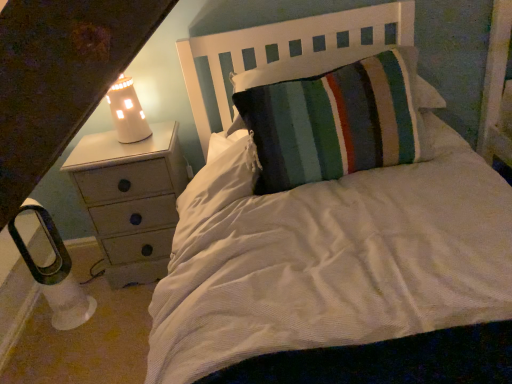
Where is `white ceramic lamp at upper left, the 2th lamp ordered from the bottom`? The height and width of the screenshot is (384, 512). white ceramic lamp at upper left, the 2th lamp ordered from the bottom is located at coordinates (127, 112).

Measure the distance between point [48,297] and camera.

The depth of point [48,297] is 1.80 meters.

Describe the element at coordinates (55, 274) in the screenshot. The image size is (512, 384). I see `white plastic lamp at lower left, the 1th lamp positioned from the bottom` at that location.

What are the coordinates of `white ceramic lamp at upper left, which is the 1th lamp from right to left` in the screenshot? It's located at (127, 112).

Considering their positions, is white wood headboard at upper center located in front of or behind white ceramic lamp at upper left, positioned as the 1th lamp in top-to-bottom order?

white wood headboard at upper center is in front of white ceramic lamp at upper left, positioned as the 1th lamp in top-to-bottom order.

Does white wood headboard at upper center appear on the right side of white ceramic lamp at upper left, the 2th lamp ordered from the bottom?

Yes, white wood headboard at upper center is to the right of white ceramic lamp at upper left, the 2th lamp ordered from the bottom.

In terms of height, does white wood headboard at upper center look taller or shorter compared to white ceramic lamp at upper left, positioned as the 1th lamp in top-to-bottom order?

Clearly, white wood headboard at upper center is shorter compared to white ceramic lamp at upper left, positioned as the 1th lamp in top-to-bottom order.

Does white wood headboard at upper center have a greater width compared to white ceramic lamp at upper left, acting as the 2th lamp starting from the left?

Yes, white wood headboard at upper center is wider than white ceramic lamp at upper left, acting as the 2th lamp starting from the left.

Is white ceramic lamp at upper left, positioned as the 1th lamp in top-to-bottom order, taller than white plastic lamp at lower left, acting as the second lamp starting from the top?

No.

Considering the sizes of objects white ceramic lamp at upper left, the 2th lamp ordered from the bottom, and white plastic lamp at lower left, acting as the second lamp starting from the top, in the image provided, who is bigger, white ceramic lamp at upper left, the 2th lamp ordered from the bottom, or white plastic lamp at lower left, acting as the second lamp starting from the top,?

white plastic lamp at lower left, acting as the second lamp starting from the top.

What's the angular difference between white ceramic lamp at upper left, acting as the 2th lamp starting from the left, and white plastic lamp at lower left, the 2th lamp positioned from the right,'s facing directions?

The angular difference between white ceramic lamp at upper left, acting as the 2th lamp starting from the left, and white plastic lamp at lower left, the 2th lamp positioned from the right, is 40 degrees.

Is the depth of white ceramic lamp at upper left, the 2th lamp ordered from the bottom, less than that of white plastic lamp at lower left, the 1th lamp positioned from the bottom?

No, white ceramic lamp at upper left, the 2th lamp ordered from the bottom, is further to the viewer.

Considering the relative sizes of white wood headboard at upper center and white painted wood chest of drawers at left in the image provided, is white wood headboard at upper center taller than white painted wood chest of drawers at left?

No.

Considering the relative positions of white wood headboard at upper center and white painted wood chest of drawers at left in the image provided, is white wood headboard at upper center to the right of white painted wood chest of drawers at left from the viewer's perspective?

Correct, you'll find white wood headboard at upper center to the right of white painted wood chest of drawers at left.

Is white wood headboard at upper center directly adjacent to white painted wood chest of drawers at left?

No, white wood headboard at upper center is not touching white painted wood chest of drawers at left.

From a real-world perspective, who is located lower, white wood headboard at upper center or white painted wood chest of drawers at left?

From a 3D spatial view, white painted wood chest of drawers at left is below.

Does white plastic lamp at lower left, the 1th lamp positioned from the bottom, turn towards white wood headboard at upper center?

No, white plastic lamp at lower left, the 1th lamp positioned from the bottom, is not aimed at white wood headboard at upper center.

Considering the relative sizes of white plastic lamp at lower left, marked as the 1th lamp in a left-to-right arrangement, and white wood headboard at upper center in the image provided, is white plastic lamp at lower left, marked as the 1th lamp in a left-to-right arrangement, wider than white wood headboard at upper center?

In fact, white plastic lamp at lower left, marked as the 1th lamp in a left-to-right arrangement, might be narrower than white wood headboard at upper center.

Does white plastic lamp at lower left, the 1th lamp positioned from the bottom, have a smaller size compared to white wood headboard at upper center?

Indeed, white plastic lamp at lower left, the 1th lamp positioned from the bottom, has a smaller size compared to white wood headboard at upper center.

Can you tell me how much white plastic lamp at lower left, the 1th lamp positioned from the bottom, and white painted wood chest of drawers at left differ in facing direction?

white plastic lamp at lower left, the 1th lamp positioned from the bottom, and white painted wood chest of drawers at left are facing 39.1 degrees away from each other.

Which object is further away from the camera taking this photo, white plastic lamp at lower left, the 1th lamp positioned from the bottom, or white painted wood chest of drawers at left?

white painted wood chest of drawers at left is behind.

Is white plastic lamp at lower left, marked as the 1th lamp in a left-to-right arrangement, outside of white painted wood chest of drawers at left?

white plastic lamp at lower left, marked as the 1th lamp in a left-to-right arrangement, lies outside white painted wood chest of drawers at left's area.

Considering the relative positions of white wood headboard at upper center and white plastic lamp at lower left, marked as the 1th lamp in a left-to-right arrangement, in the image provided, is white wood headboard at upper center to the left of white plastic lamp at lower left, marked as the 1th lamp in a left-to-right arrangement, from the viewer's perspective?

In fact, white wood headboard at upper center is to the right of white plastic lamp at lower left, marked as the 1th lamp in a left-to-right arrangement.

From a real-world perspective, is white wood headboard at upper center located beneath white plastic lamp at lower left, marked as the 1th lamp in a left-to-right arrangement?

No, from a real-world perspective, white wood headboard at upper center is not under white plastic lamp at lower left, marked as the 1th lamp in a left-to-right arrangement.

Is white plastic lamp at lower left, acting as the second lamp starting from the top, at the back of white wood headboard at upper center?

That's not correct — white wood headboard at upper center is not looking away from white plastic lamp at lower left, acting as the second lamp starting from the top.

Which is further, (x=122, y=139) or (x=212, y=50)?

The point (x=212, y=50) is more distant.

Considering the relative positions of white ceramic lamp at upper left, which is the 1th lamp from right to left, and white wood headboard at upper center in the image provided, is white ceramic lamp at upper left, which is the 1th lamp from right to left, behind white wood headboard at upper center?

Yes, white ceramic lamp at upper left, which is the 1th lamp from right to left, is further from the viewer.

Considering the relative positions of white ceramic lamp at upper left, positioned as the 1th lamp in top-to-bottom order, and white wood headboard at upper center in the image provided, is white ceramic lamp at upper left, positioned as the 1th lamp in top-to-bottom order, to the left or to the right of white wood headboard at upper center?

In the image, white ceramic lamp at upper left, positioned as the 1th lamp in top-to-bottom order, appears on the left side of white wood headboard at upper center.

This screenshot has width=512, height=384. What are the coordinates of `the 1st lamp to the left when counting from the white wood headboard at upper center` in the screenshot? It's located at (127, 112).

You are a GUI agent. You are given a task and a screenshot of the screen. Output one action in this format:
    pyautogui.click(x=<x>, y=<y>)
    Task: Click on the headboard that appears below the white ceramic lamp at upper left, the 2th lamp ordered from the bottom (from a real-world perspective)
    The width and height of the screenshot is (512, 384).
    Given the screenshot: What is the action you would take?
    pyautogui.click(x=278, y=52)

Where is `lamp above the white plastic lamp at lower left, the 2th lamp positioned from the right (from the image's perspective)`? Image resolution: width=512 pixels, height=384 pixels. lamp above the white plastic lamp at lower left, the 2th lamp positioned from the right (from the image's perspective) is located at coordinates (127, 112).

Looking at this image, which object lies further to the anchor point white plastic lamp at lower left, marked as the 1th lamp in a left-to-right arrangement, white ceramic lamp at upper left, which is the 1th lamp from right to left, or white painted wood chest of drawers at left?

white ceramic lamp at upper left, which is the 1th lamp from right to left, lies further to white plastic lamp at lower left, marked as the 1th lamp in a left-to-right arrangement, than the other object.

Which object lies further to the anchor point white painted wood chest of drawers at left, white plastic lamp at lower left, the 1th lamp positioned from the bottom, or white wood headboard at upper center?

Based on the image, white wood headboard at upper center appears to be further to white painted wood chest of drawers at left.

Which object lies further to the anchor point white wood headboard at upper center, white ceramic lamp at upper left, positioned as the 1th lamp in top-to-bottom order, or white painted wood chest of drawers at left?

white painted wood chest of drawers at left is positioned further to the anchor white wood headboard at upper center.

Based on the photo, looking at the image, which one is located further to white ceramic lamp at upper left, which is the 1th lamp from right to left, white painted wood chest of drawers at left or white plastic lamp at lower left, acting as the second lamp starting from the top?

white plastic lamp at lower left, acting as the second lamp starting from the top, is positioned further to the anchor white ceramic lamp at upper left, which is the 1th lamp from right to left.

When comparing their distances from white ceramic lamp at upper left, the 2th lamp ordered from the bottom, does white wood headboard at upper center or white painted wood chest of drawers at left seem closer?

white painted wood chest of drawers at left lies closer to white ceramic lamp at upper left, the 2th lamp ordered from the bottom, than the other object.

When comparing their distances from white ceramic lamp at upper left, which is the 1th lamp from right to left, does white wood headboard at upper center or white plastic lamp at lower left, marked as the 1th lamp in a left-to-right arrangement, seem closer?

white wood headboard at upper center is closer to white ceramic lamp at upper left, which is the 1th lamp from right to left.

Considering their positions, is white plastic lamp at lower left, acting as the second lamp starting from the top, positioned further to white wood headboard at upper center than white ceramic lamp at upper left, positioned as the 1th lamp in top-to-bottom order?

Among the two, white plastic lamp at lower left, acting as the second lamp starting from the top, is located further to white wood headboard at upper center.

When comparing their distances from white wood headboard at upper center, does white painted wood chest of drawers at left or white ceramic lamp at upper left, the 2th lamp ordered from the bottom, seem further?

white painted wood chest of drawers at left.

Where is `chest of drawers between white plastic lamp at lower left, marked as the 1th lamp in a left-to-right arrangement, and white wood headboard at upper center from left to right`? This screenshot has width=512, height=384. chest of drawers between white plastic lamp at lower left, marked as the 1th lamp in a left-to-right arrangement, and white wood headboard at upper center from left to right is located at coordinates (131, 199).

I want to click on the chest of drawers that lies between white ceramic lamp at upper left, positioned as the 1th lamp in top-to-bottom order, and white plastic lamp at lower left, acting as the second lamp starting from the top, from top to bottom, so click(x=131, y=199).

Find the location of a particular element. Image resolution: width=512 pixels, height=384 pixels. lamp between white plastic lamp at lower left, the 2th lamp positioned from the right, and white wood headboard at upper center from left to right is located at coordinates (127, 112).

The width and height of the screenshot is (512, 384). Find the location of `chest of drawers between white ceramic lamp at upper left, which is the 1th lamp from right to left, and white wood headboard at upper center from left to right`. chest of drawers between white ceramic lamp at upper left, which is the 1th lamp from right to left, and white wood headboard at upper center from left to right is located at coordinates (131, 199).